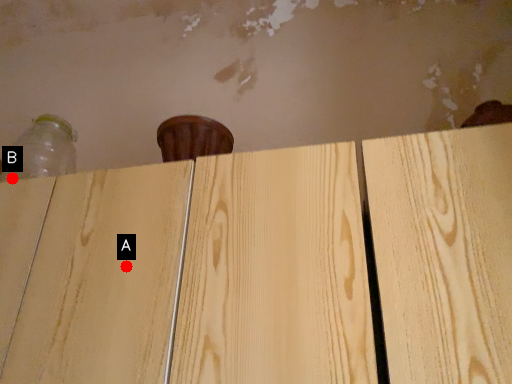
Question: Two points are circled on the image, labeled by A and B beside each circle. Which point appears farthest from the camera in this image?

Choices:
 (A) A is further
 (B) B is further

Answer: (B)